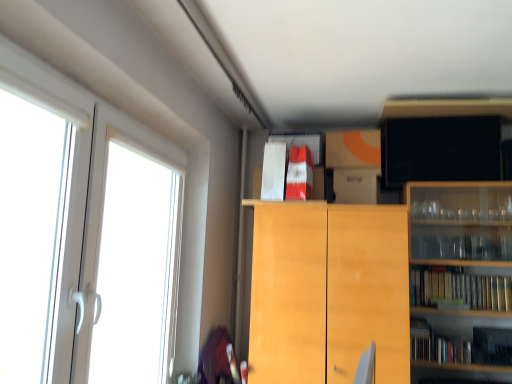
Describe the element at coordinates (128, 255) in the screenshot. The height and width of the screenshot is (384, 512). I see `white plastic screen door at left` at that location.

In order to face white paper bag at upper center, the second book from the bottom, should I rotate leftwards or rightwards?

Turn right approximately 2.994 degrees to face it.

What is the approximate width of light wood cabinet at center, which appears as the 4th cabinetry when viewed from the top?

light wood cabinet at center, which appears as the 4th cabinetry when viewed from the top, is 44.54 centimeters wide.

Measure the distance between point [319,376] and camera.

7.03 feet.

The width and height of the screenshot is (512, 384). Describe the element at coordinates (298, 173) in the screenshot. I see `red glossy book at upper center, arranged as the second book when viewed from the left` at that location.

I want to click on white plastic screen door at left, so click(x=128, y=255).

Considering the positions of objects orange matte cardboard box at upper center, the third cabinetry ordered from the bottom, and light wood cabinet at center, which appears as the 4th cabinetry when viewed from the top, in the image provided, who is more to the left, orange matte cardboard box at upper center, the third cabinetry ordered from the bottom, or light wood cabinet at center, which appears as the 4th cabinetry when viewed from the top,?

Positioned to the left is light wood cabinet at center, which appears as the 4th cabinetry when viewed from the top.

Between orange matte cardboard box at upper center, the third cabinetry ordered from the bottom, and light wood cabinet at center, which appears as the 4th cabinetry when viewed from the top, which one has larger size?

light wood cabinet at center, which appears as the 4th cabinetry when viewed from the top.

Considering the positions of objects orange matte cardboard box at upper center, the third cabinetry ordered from the bottom, and light wood cabinet at center, the 1th cabinetry positioned from the bottom, in the image provided, who is behind, orange matte cardboard box at upper center, the third cabinetry ordered from the bottom, or light wood cabinet at center, the 1th cabinetry positioned from the bottom,?

orange matte cardboard box at upper center, the third cabinetry ordered from the bottom, is more distant.

Is orange matte cardboard box at upper center, which is the second cabinetry in top-to-bottom order, facing towards light wood cabinet at center, the 1th cabinetry positioned from the bottom?

No, orange matte cardboard box at upper center, which is the second cabinetry in top-to-bottom order, is not facing towards light wood cabinet at center, the 1th cabinetry positioned from the bottom.

Is point (429, 108) positioned before point (450, 276)?

Yes, it is.

Is black matte tv at upper right, marked as the 1th cabinetry in a top-to-bottom arrangement, facing away from hardcover books at right, which appears as the 1th book when ordered from the bottom?

No.

This screenshot has height=384, width=512. What are the coordinates of `book that is the 3rd one below the black matte tv at upper right, marked as the 1th cabinetry in a top-to-bottom arrangement (from a real-world perspective)` in the screenshot? It's located at (460, 289).

Would you say light wood cabinet at center, the 1th cabinetry positioned from the bottom, contains hardcover books at right, the first book from the right?

Definitely not — hardcover books at right, the first book from the right, is not inside light wood cabinet at center, the 1th cabinetry positioned from the bottom.

Is light wood cabinet at center, which appears as the 4th cabinetry when viewed from the top, facing away from hardcover books at right, the 3th book viewed from the top?

No, light wood cabinet at center, which appears as the 4th cabinetry when viewed from the top,'s orientation is not away from hardcover books at right, the 3th book viewed from the top.

Consider the image. Considering the relative sizes of light wood cabinet at center, which appears as the 4th cabinetry when viewed from the top, and hardcover books at right, which appears as the 1th book when ordered from the bottom, in the image provided, is light wood cabinet at center, which appears as the 4th cabinetry when viewed from the top, bigger than hardcover books at right, which appears as the 1th book when ordered from the bottom,?

Yes.

Is hardcover books at right, the 3th book viewed from the top, positioned with its back to black matte tv at upper right, positioned as the 4th cabinetry in bottom-to-top order?

No, hardcover books at right, the 3th book viewed from the top, is not facing away from black matte tv at upper right, positioned as the 4th cabinetry in bottom-to-top order.

Can you see hardcover books at right, the 3th book from the left, touching black matte tv at upper right, marked as the 1th cabinetry in a top-to-bottom arrangement?

There is a gap between hardcover books at right, the 3th book from the left, and black matte tv at upper right, marked as the 1th cabinetry in a top-to-bottom arrangement.

Which object is positioned more to the left, hardcover books at right, the first book from the right, or black matte tv at upper right, marked as the 1th cabinetry in a top-to-bottom arrangement?

black matte tv at upper right, marked as the 1th cabinetry in a top-to-bottom arrangement, is more to the left.

Is point (168, 241) closer to viewer compared to point (461, 273)?

Yes, point (168, 241) is in front of point (461, 273).

Is white plastic screen door at left taller than hardcover books at right, which appears as the 1th book when ordered from the bottom?

Yes.

Considering the relative sizes of white plastic screen door at left and hardcover books at right, the 3th book viewed from the top, in the image provided, is white plastic screen door at left bigger than hardcover books at right, the 3th book viewed from the top,?

Correct, white plastic screen door at left is larger in size than hardcover books at right, the 3th book viewed from the top.

Consider the image. Considering the positions of objects white plastic screen door at left and hardcover books at right, the 3th book from the left, in the image provided, who is behind, white plastic screen door at left or hardcover books at right, the 3th book from the left,?

hardcover books at right, the 3th book from the left, is further from the camera.

Measure the distance from black matte tv at upper right, marked as the 1th cabinetry in a top-to-bottom arrangement, to red glossy book at upper center, placed as the 3th book when sorted from bottom to top.

black matte tv at upper right, marked as the 1th cabinetry in a top-to-bottom arrangement, and red glossy book at upper center, placed as the 3th book when sorted from bottom to top, are 76.39 centimeters apart.

What's the angular difference between black matte tv at upper right, marked as the 1th cabinetry in a top-to-bottom arrangement, and red glossy book at upper center, acting as the first book starting from the top,'s facing directions?

0.00555 degrees separate the facing orientations of black matte tv at upper right, marked as the 1th cabinetry in a top-to-bottom arrangement, and red glossy book at upper center, acting as the first book starting from the top.

From the image's perspective, is black matte tv at upper right, marked as the 1th cabinetry in a top-to-bottom arrangement, located above red glossy book at upper center, placed as the 3th book when sorted from bottom to top?

Yes, from the image's perspective, black matte tv at upper right, marked as the 1th cabinetry in a top-to-bottom arrangement, is on top of red glossy book at upper center, placed as the 3th book when sorted from bottom to top.

In terms of width, does black matte tv at upper right, positioned as the 4th cabinetry in bottom-to-top order, look wider or thinner when compared to red glossy book at upper center, placed as the 3th book when sorted from bottom to top?

In the image, black matte tv at upper right, positioned as the 4th cabinetry in bottom-to-top order, appears to be more narrow than red glossy book at upper center, placed as the 3th book when sorted from bottom to top.

How distant is white paper bag at upper center, acting as the first book starting from the left, from light wood cabinet at center, the 1th cabinetry positioned from the bottom?

white paper bag at upper center, acting as the first book starting from the left, is 50.00 centimeters from light wood cabinet at center, the 1th cabinetry positioned from the bottom.

Is white paper bag at upper center, arranged as the third book when viewed from the right, smaller than light wood cabinet at center, which appears as the 4th cabinetry when viewed from the top?

Indeed, white paper bag at upper center, arranged as the third book when viewed from the right, has a smaller size compared to light wood cabinet at center, which appears as the 4th cabinetry when viewed from the top.

From the image's perspective, would you say white paper bag at upper center, acting as the first book starting from the left, is positioned over light wood cabinet at center, the 1th cabinetry positioned from the bottom?

Yes.

Is white paper bag at upper center, acting as the first book starting from the left, aimed at light wood cabinet at center, the 1th cabinetry positioned from the bottom?

No, white paper bag at upper center, acting as the first book starting from the left, is not aimed at light wood cabinet at center, the 1th cabinetry positioned from the bottom.

From the image's perspective, count 2nd cabinetrys downward from the orange matte cardboard box at upper center, the third cabinetry ordered from the bottom, and point to it. Please provide its 2D coordinates.

[(328, 292)]

Where is `book that is the 3rd object directly below the black matte tv at upper right, positioned as the 4th cabinetry in bottom-to-top order (from a real-world perspective)`? This screenshot has width=512, height=384. book that is the 3rd object directly below the black matte tv at upper right, positioned as the 4th cabinetry in bottom-to-top order (from a real-world perspective) is located at coordinates (460, 289).

Based on their spatial positions, is white cardboard box at upper center, placed as the third cabinetry when sorted from top to bottom, or white paper bag at upper center, placed as the 2th book when sorted from top to bottom, further from black matte tv at upper right, positioned as the 4th cabinetry in bottom-to-top order?

white paper bag at upper center, placed as the 2th book when sorted from top to bottom, is positioned further to the anchor black matte tv at upper right, positioned as the 4th cabinetry in bottom-to-top order.

When comparing their distances from orange matte cardboard box at upper center, the third cabinetry ordered from the bottom, does white cardboard box at upper center, placed as the third cabinetry when sorted from top to bottom, or black matte tv at upper right, positioned as the 4th cabinetry in bottom-to-top order, seem closer?

Among the two, white cardboard box at upper center, placed as the third cabinetry when sorted from top to bottom, is located nearer to orange matte cardboard box at upper center, the third cabinetry ordered from the bottom.

From the image, which object appears to be farther from red glossy book at upper center, acting as the first book starting from the top, white plastic screen door at left or hardcover books at right, the 3th book from the left?

The object further to red glossy book at upper center, acting as the first book starting from the top, is hardcover books at right, the 3th book from the left.

Which object lies nearer to the anchor point white cardboard box at upper center, placed as the third cabinetry when sorted from top to bottom, orange matte cardboard box at upper center, which is the second cabinetry in top-to-bottom order, or hardcover books at right, the first book from the right?

orange matte cardboard box at upper center, which is the second cabinetry in top-to-bottom order.

Looking at the image, which one is located closer to light wood cabinet at center, the 1th cabinetry positioned from the bottom, white cardboard box at upper center, the 2th cabinetry positioned from the bottom, or orange matte cardboard box at upper center, the third cabinetry ordered from the bottom?

white cardboard box at upper center, the 2th cabinetry positioned from the bottom, lies closer to light wood cabinet at center, the 1th cabinetry positioned from the bottom, than the other object.

Which object lies nearer to the anchor point orange matte cardboard box at upper center, which is the second cabinetry in top-to-bottom order, black matte tv at upper right, positioned as the 4th cabinetry in bottom-to-top order, or white paper bag at upper center, the second book from the bottom?

Based on the image, black matte tv at upper right, positioned as the 4th cabinetry in bottom-to-top order, appears to be nearer to orange matte cardboard box at upper center, which is the second cabinetry in top-to-bottom order.

Based on their spatial positions, is hardcover books at right, the 3th book from the left, or orange matte cardboard box at upper center, which is the second cabinetry in top-to-bottom order, closer to white cardboard box at upper center, placed as the third cabinetry when sorted from top to bottom?

orange matte cardboard box at upper center, which is the second cabinetry in top-to-bottom order, lies closer to white cardboard box at upper center, placed as the third cabinetry when sorted from top to bottom, than the other object.

Considering their positions, is hardcover books at right, the 3th book viewed from the top, positioned further to orange matte cardboard box at upper center, the third cabinetry ordered from the bottom, than white paper bag at upper center, arranged as the third book when viewed from the right?

hardcover books at right, the 3th book viewed from the top, lies further to orange matte cardboard box at upper center, the third cabinetry ordered from the bottom, than the other object.

Find the location of a particular element. The width and height of the screenshot is (512, 384). cabinetry between orange matte cardboard box at upper center, which is the second cabinetry in top-to-bottom order, and light wood cabinet at center, the 1th cabinetry positioned from the bottom, in the up-down direction is located at coordinates (356, 185).

Where is `cabinetry between white plastic screen door at left and orange matte cardboard box at upper center, which is the second cabinetry in top-to-bottom order, from left to right`? cabinetry between white plastic screen door at left and orange matte cardboard box at upper center, which is the second cabinetry in top-to-bottom order, from left to right is located at coordinates (328, 292).

The width and height of the screenshot is (512, 384). I want to click on book between white plastic screen door at left and white paper bag at upper center, the second book from the bottom, along the z-axis, so click(298, 173).

Where is `cabinetry between white paper bag at upper center, placed as the 2th book when sorted from top to bottom, and light wood cabinet at center, which appears as the 4th cabinetry when viewed from the top, vertically`? The height and width of the screenshot is (384, 512). cabinetry between white paper bag at upper center, placed as the 2th book when sorted from top to bottom, and light wood cabinet at center, which appears as the 4th cabinetry when viewed from the top, vertically is located at coordinates (356, 185).